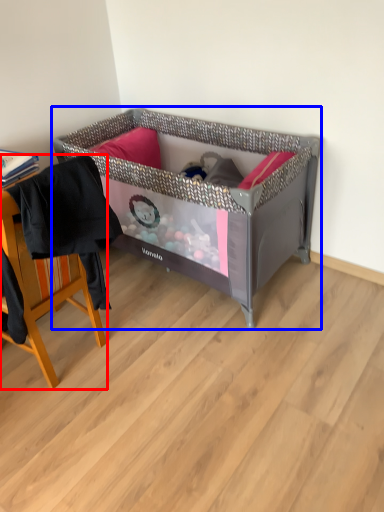
Question: Which point is further to the camera, chair (highlighted by a red box) or infant bed (highlighted by a blue box)?

Choices:
 (A) chair
 (B) infant bed

Answer: (B)